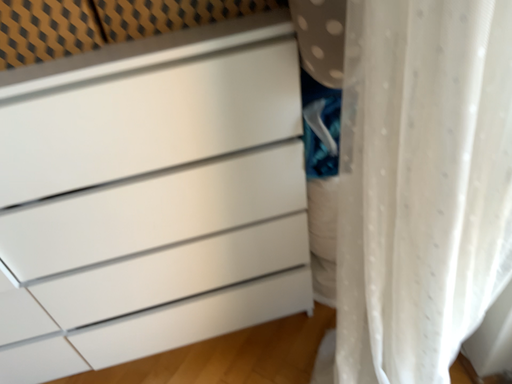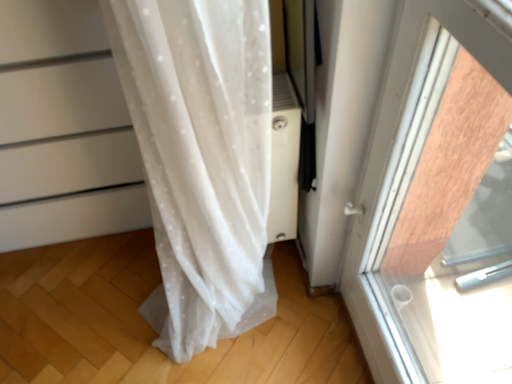
Question: How did the camera likely rotate when shooting the video?

Choices:
 (A) rotated downward
 (B) rotated upward

Answer: (A)